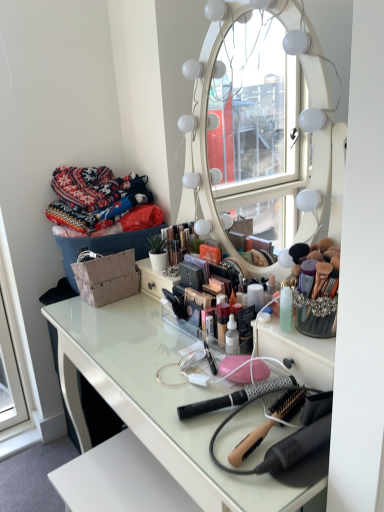
Question: Relative to knitted fabric sweater at upper left, is black plastic brush at center, placed as the 2th brush when sorted from front to back, in front or behind?

Choices:
 (A) front
 (B) behind

Answer: (A)

Question: Is black plastic brush at center, placed as the 2th brush when sorted from front to back, taller or shorter than knitted fabric sweater at upper left?

Choices:
 (A) tall
 (B) short

Answer: (B)

Question: Estimate the real-world distances between objects in this image. Which object is closer to the black plastic brush at center, the 1th brush when ordered from back to front?

Choices:
 (A) wooden-handled hairbrush at center, which is counted as the second brush, starting from the back
 (B) knitted fabric sweater at upper left
 (C) white glossy table at center

Answer: (A)

Question: Which object is positioned closest to the knitted fabric sweater at upper left?

Choices:
 (A) black plastic brush at center, placed as the 2th brush when sorted from front to back
 (B) wooden-handled hairbrush at center, which is counted as the second brush, starting from the back
 (C) white glossy table at center

Answer: (C)